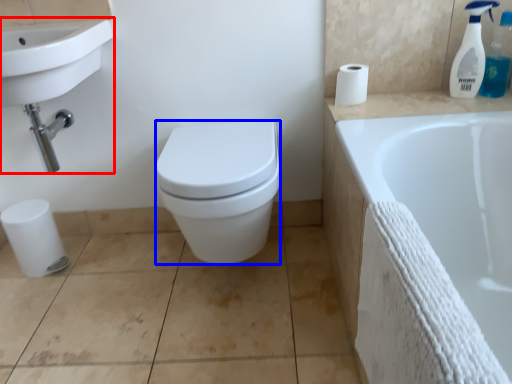
Question: Which object is further to the camera taking this photo, sink (highlighted by a red box) or bidet (highlighted by a blue box)?

Choices:
 (A) sink
 (B) bidet

Answer: (B)